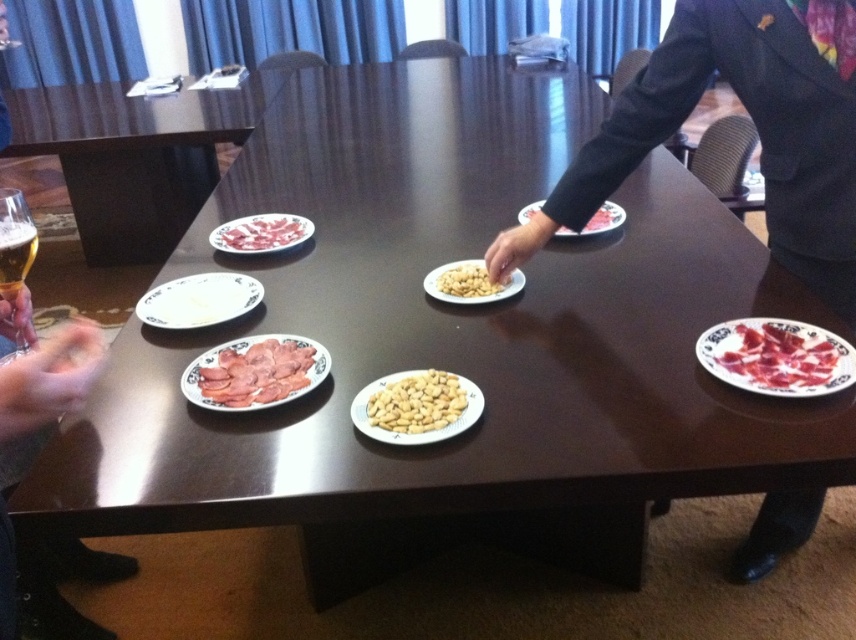
You are at a party and want to grab a snack. You see the yellow matte peanuts at center and the white glossy plate at center on the table. Which one is thinner?

The yellow matte peanuts at center is thinner than the white glossy plate at center.

You are at a party and want to grab a drink and a snack. You see the translucent glass beer at left and the yellow matte peanuts at center. Which one is taller?

The translucent glass beer at left is taller than the yellow matte peanuts at center.